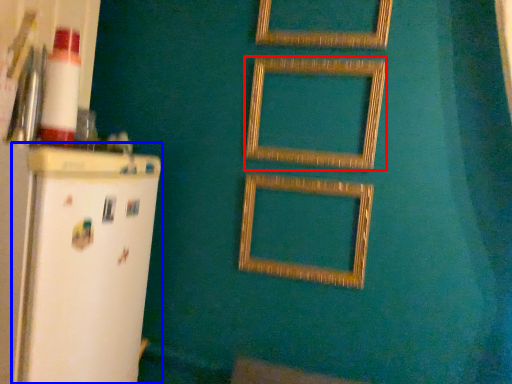
Question: Which point is further to the camera, picture frame (highlighted by a red box) or fridge (highlighted by a blue box)?

Choices:
 (A) picture frame
 (B) fridge

Answer: (A)